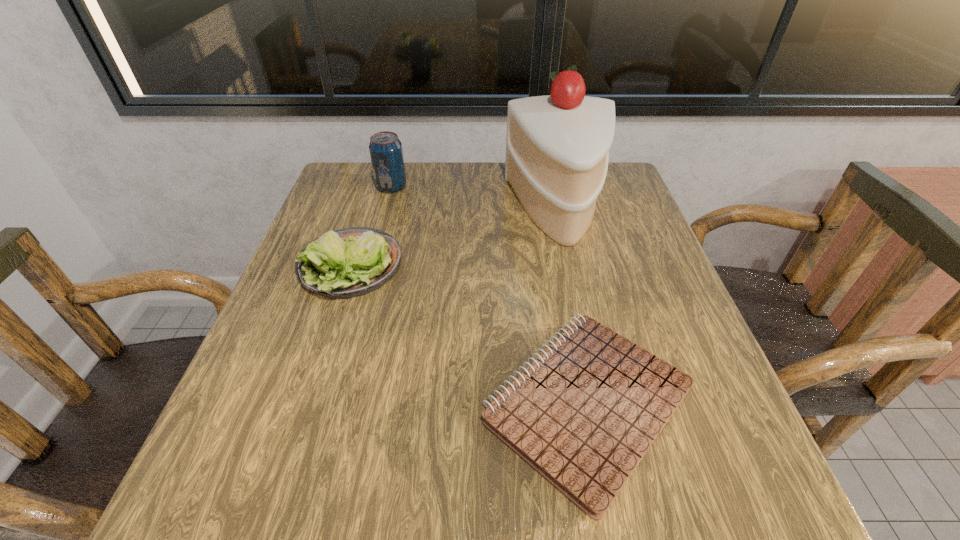
Find the location of `free space that satisfies the following two spatial constraints: 1. on the back side of the lettuce; 2. on the left side of the pop soda`. free space that satisfies the following two spatial constraints: 1. on the back side of the lettuce; 2. on the left side of the pop soda is located at coordinates (376, 187).